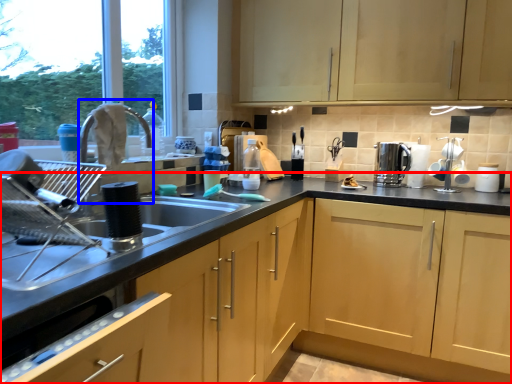
Question: Which of the following is the closest to the observer, cabinetry (highlighted by a red box) or faucet (highlighted by a blue box)?

Choices:
 (A) cabinetry
 (B) faucet

Answer: (A)